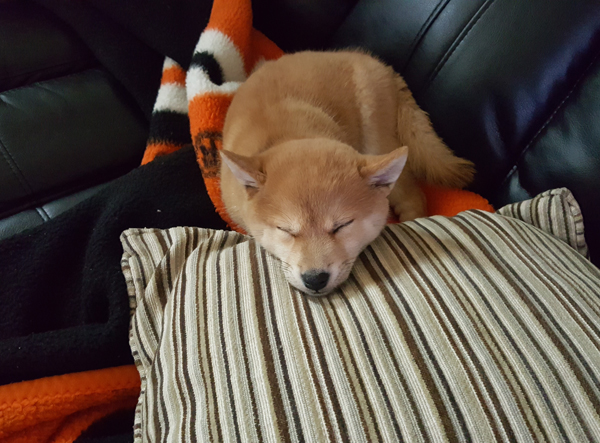
Identify the location of blanket. This screenshot has width=600, height=443. (200, 114).